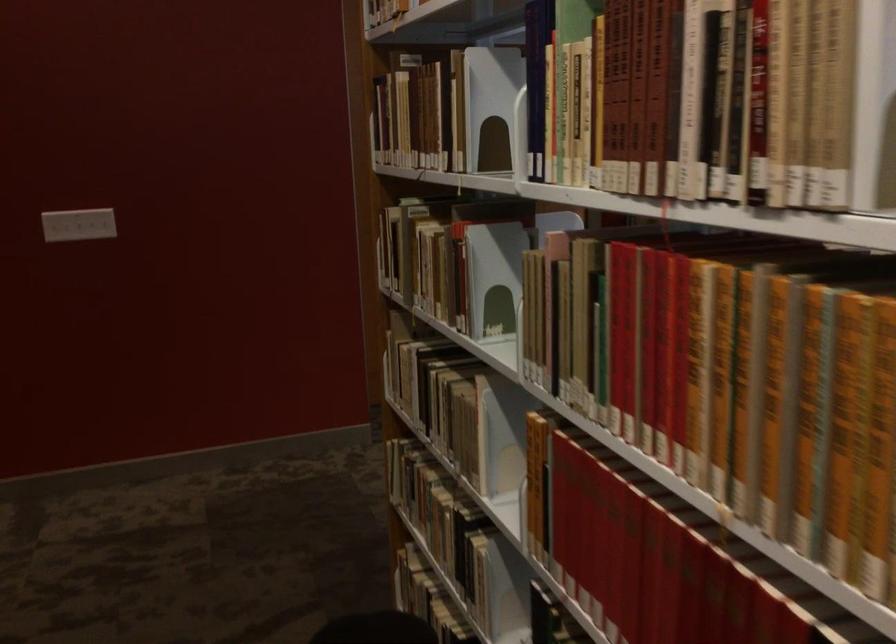
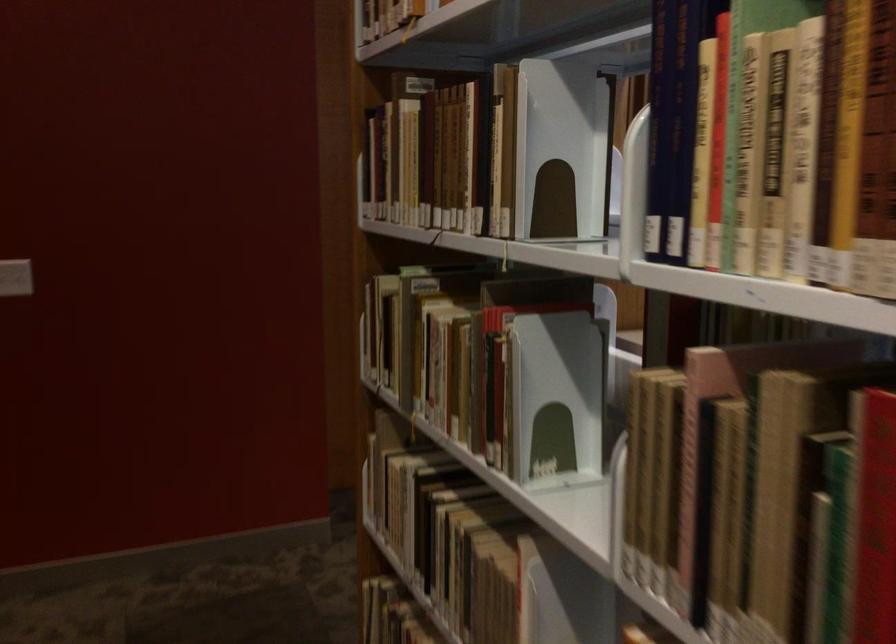
In the second image, find the point that corresponds to pixel 501 283 in the first image.

(556, 398)